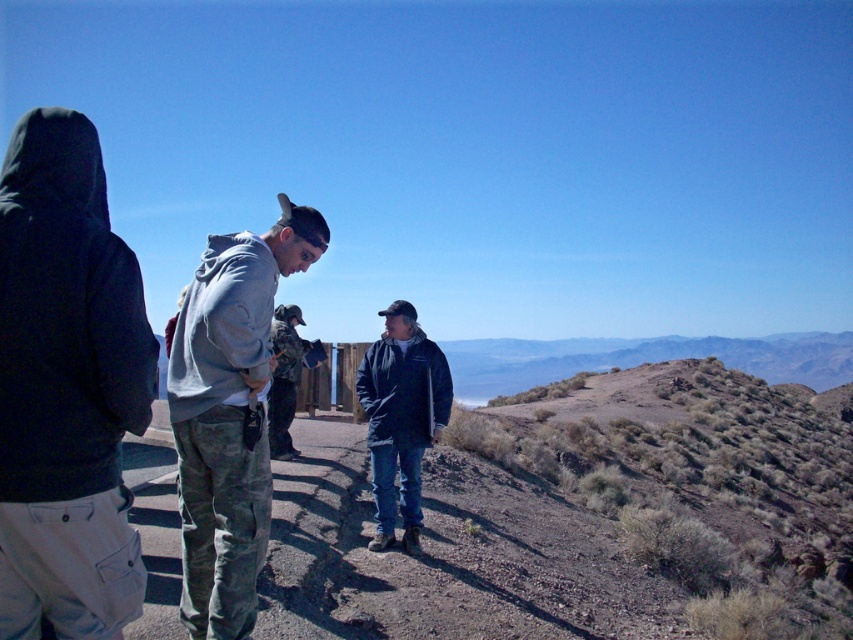
Identify the location of camouflage pants at center. The image size is (853, 640). (229, 413).

Which is in front, point (200, 506) or point (405, 392)?

Point (200, 506) is in front.

Measure the distance between point (227,605) and camera.

Point (227,605) is 3.59 meters away from camera.

The height and width of the screenshot is (640, 853). I want to click on camouflage pants at center, so click(x=229, y=413).

Is camouflage pants at center shorter than camouflage jacket at center?

Correct, camouflage pants at center is not as tall as camouflage jacket at center.

Is point (244, 259) less distant than point (274, 352)?

Yes.

At what (x,y) coordinates should I click in order to perform the action: click on camouflage pants at center. Please return your answer as a coordinate pair (x, y). The height and width of the screenshot is (640, 853). Looking at the image, I should click on (229, 413).

Does gray fleece sweatshirt at center appear over camouflage jacket at center?

Yes, gray fleece sweatshirt at center is above camouflage jacket at center.

Which is more to the right, gray fleece sweatshirt at center or camouflage jacket at center?

Positioned to the right is gray fleece sweatshirt at center.

This screenshot has height=640, width=853. Find the location of `gray fleece sweatshirt at center`. gray fleece sweatshirt at center is located at coordinates (222, 324).